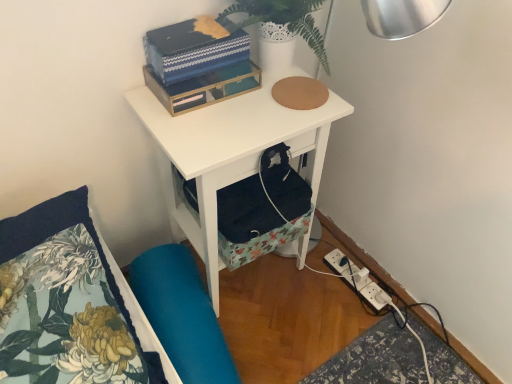
Find the location of a particular element. The image size is (512, 384). vacant space in front of white plastic power strip at lower right is located at coordinates (361, 327).